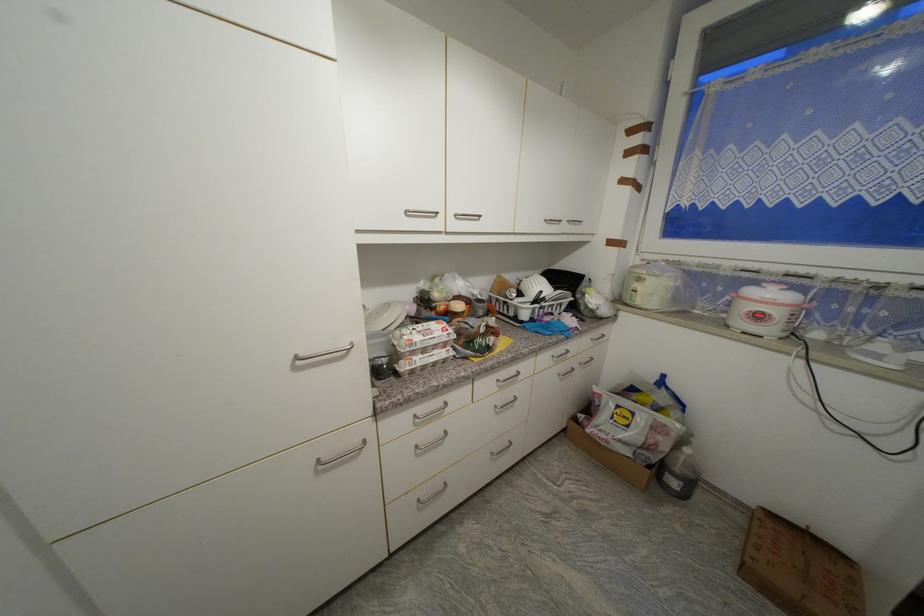
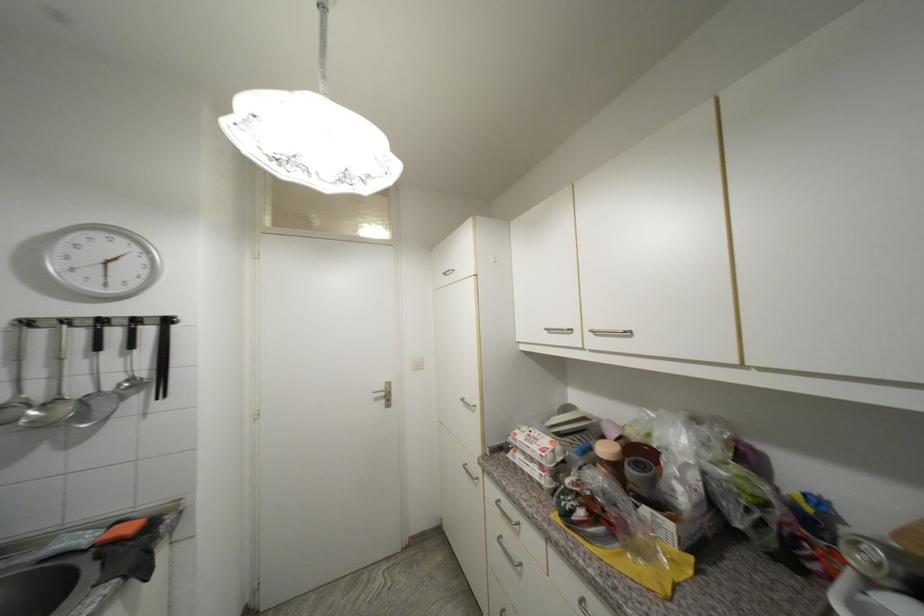
Locate, in the second image, the point that corresponds to pixel 430 325 in the first image.

(548, 436)